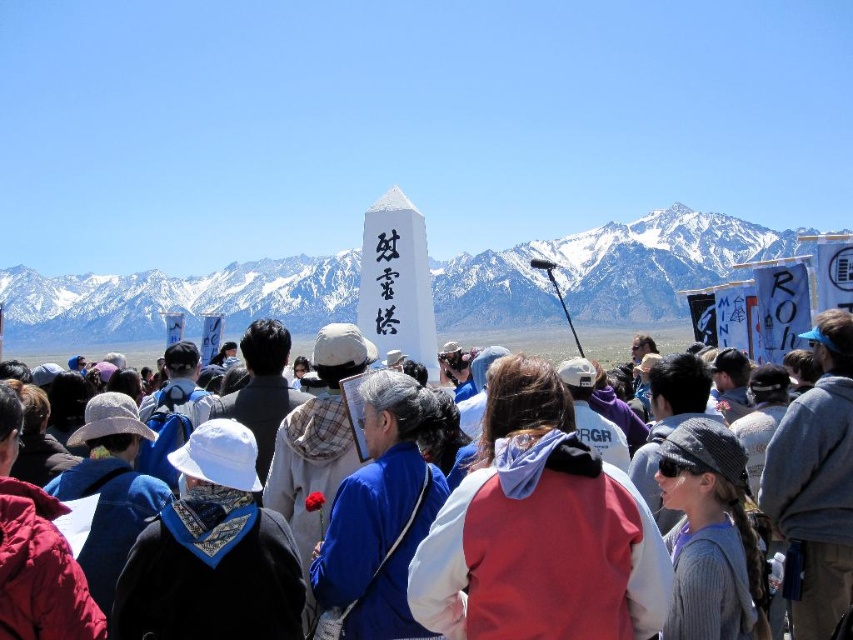
You are a photographer at the event and want to capture a photo of the red hoodie at center without the white matte monument at center blocking it. How can you adjust your position to achieve this?

Since the red hoodie at center is positioned under the white matte monument at center, you can move to the side or lower your camera angle to avoid the monument blocking the view of the red hoodie at center.